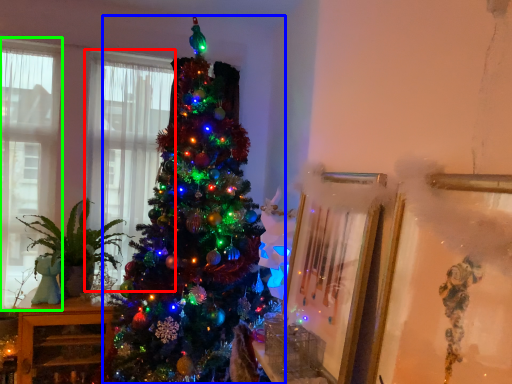
Question: Considering the real-world distances, which object is farthest from window (highlighted by a red box)? christmas tree (highlighted by a blue box) or window (highlighted by a green box)?

Choices:
 (A) christmas tree
 (B) window

Answer: (A)